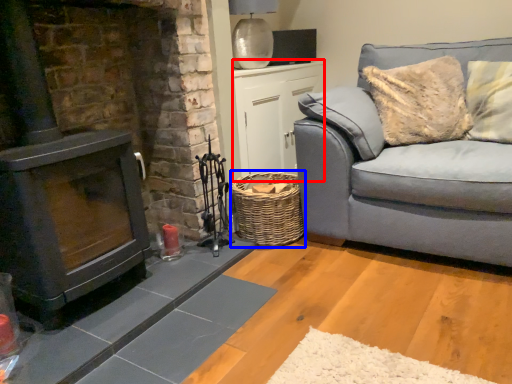
Question: Which of the following is the farthest to the observer, table (highlighted by a red box) or basket (highlighted by a blue box)?

Choices:
 (A) table
 (B) basket

Answer: (A)